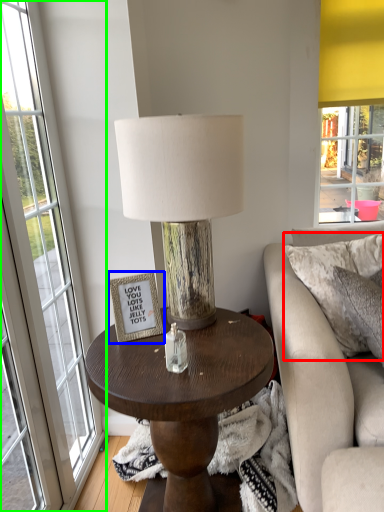
Question: Considering the real-world distances, which object is farthest from pillow (highlighted by a red box)? picture frame (highlighted by a blue box) or window (highlighted by a green box)?

Choices:
 (A) picture frame
 (B) window

Answer: (B)